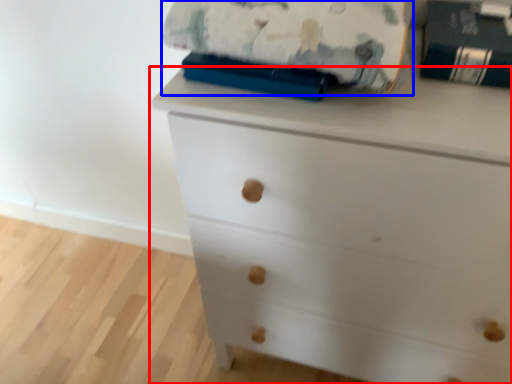
Question: Which object is further to the camera taking this photo, chest of drawers (highlighted by a red box) or blanket (highlighted by a blue box)?

Choices:
 (A) chest of drawers
 (B) blanket

Answer: (B)